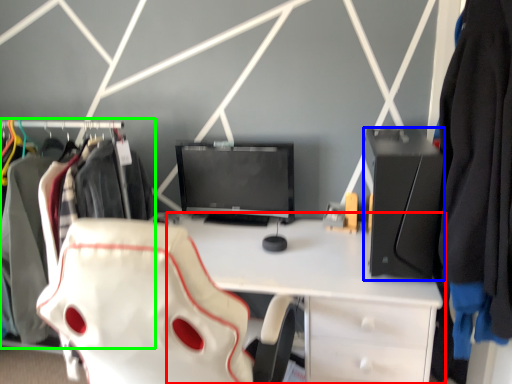
Question: Estimate the real-world distances between objects in this image. Which object is closer to desk (highlighted by a red box), desktop (highlighted by a blue box) or closet (highlighted by a green box)?

Choices:
 (A) desktop
 (B) closet

Answer: (A)